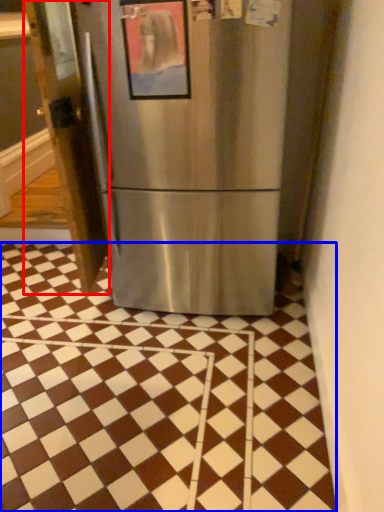
Question: Which object is further to the camera taking this photo, door (highlighted by a red box) or tile (highlighted by a blue box)?

Choices:
 (A) door
 (B) tile

Answer: (A)